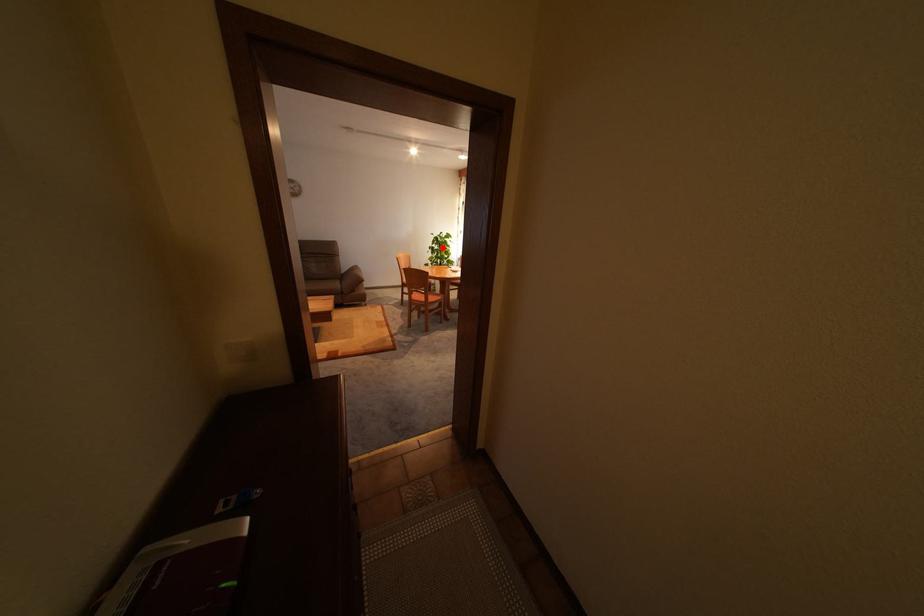
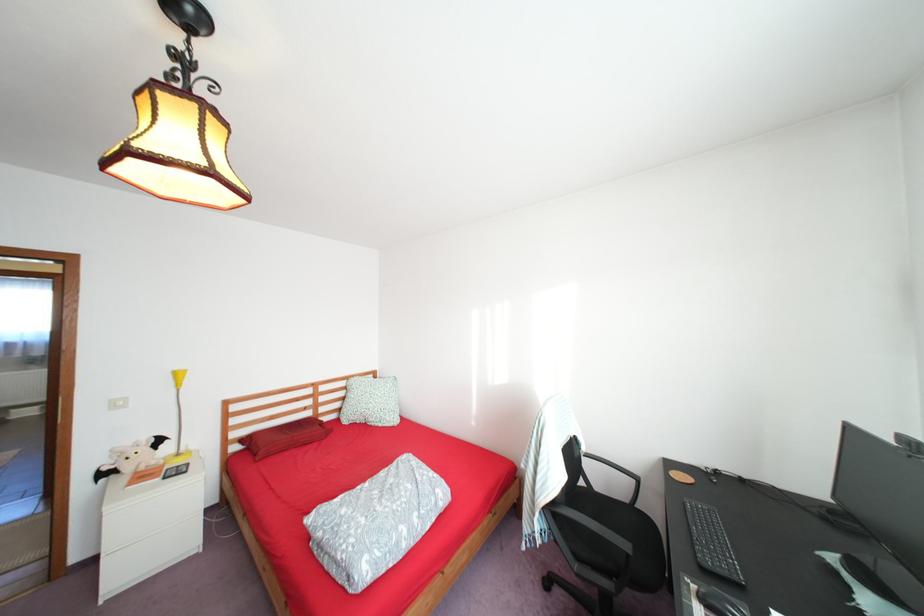
Question: I am providing you with two images of the same scene from different viewpoints. A red point is marked on the first image. Is the red point's position out of view in image 2?

Choices:
 (A) Yes
 (B) No

Answer: (A)